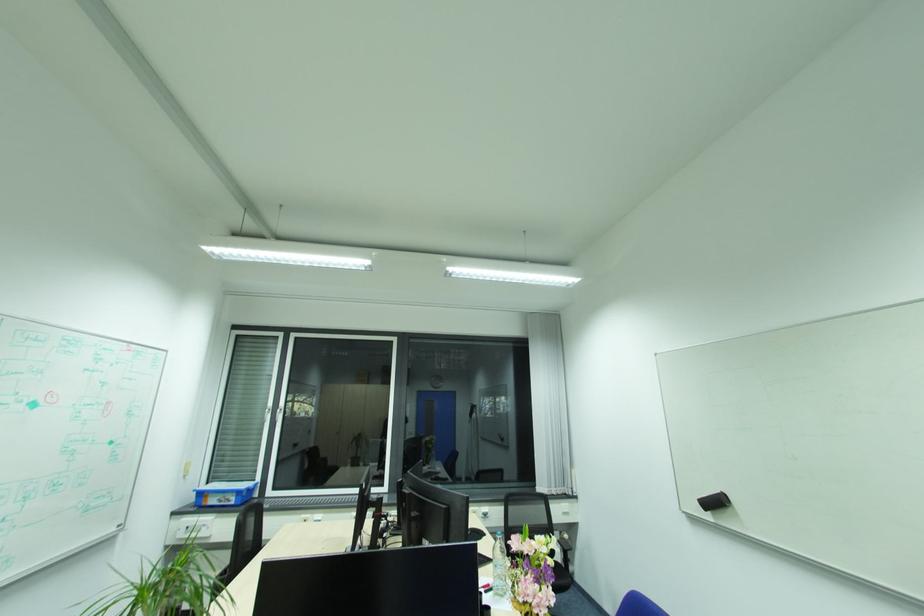
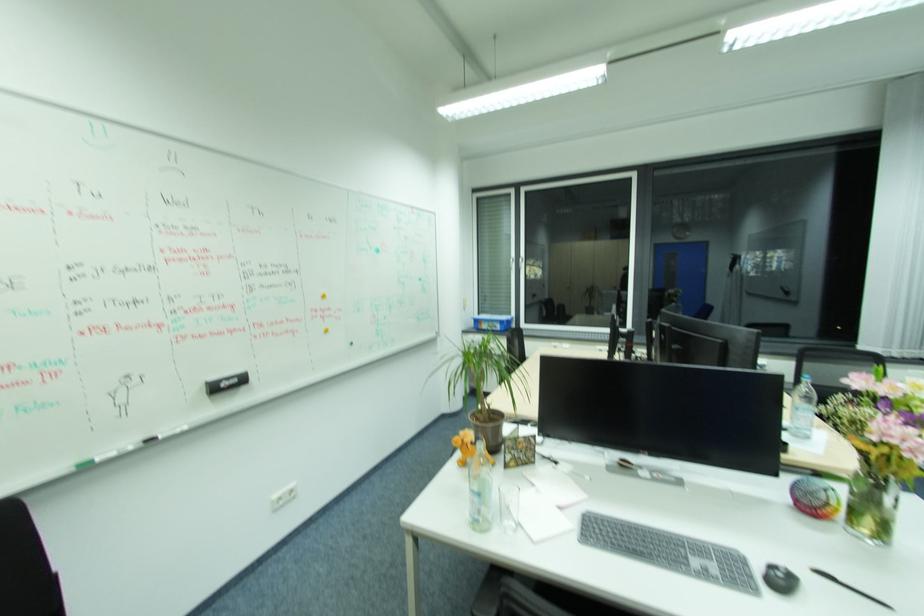
The point at (408, 504) is marked in the first image. Where is the corresponding point in the second image?

(666, 334)